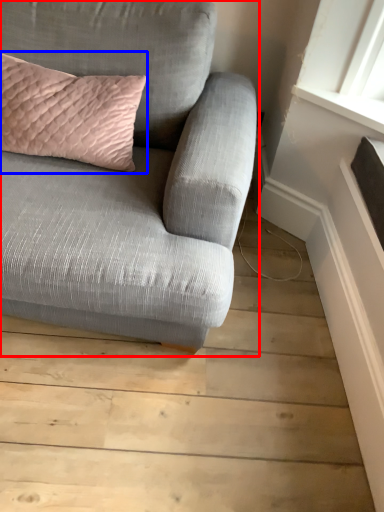
Question: Which of the following is the farthest to the observer, studio couch (highlighted by a red box) or pillow (highlighted by a blue box)?

Choices:
 (A) studio couch
 (B) pillow

Answer: (B)